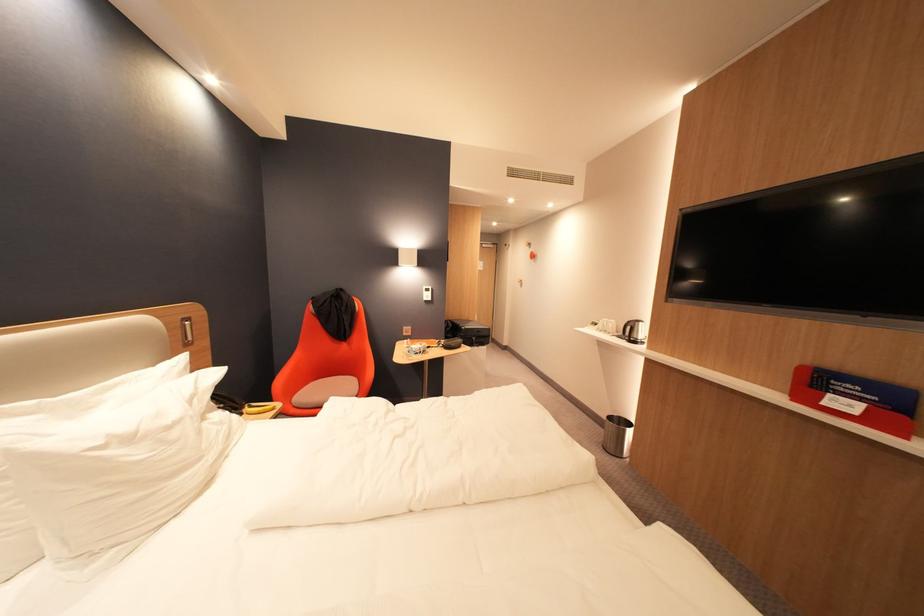
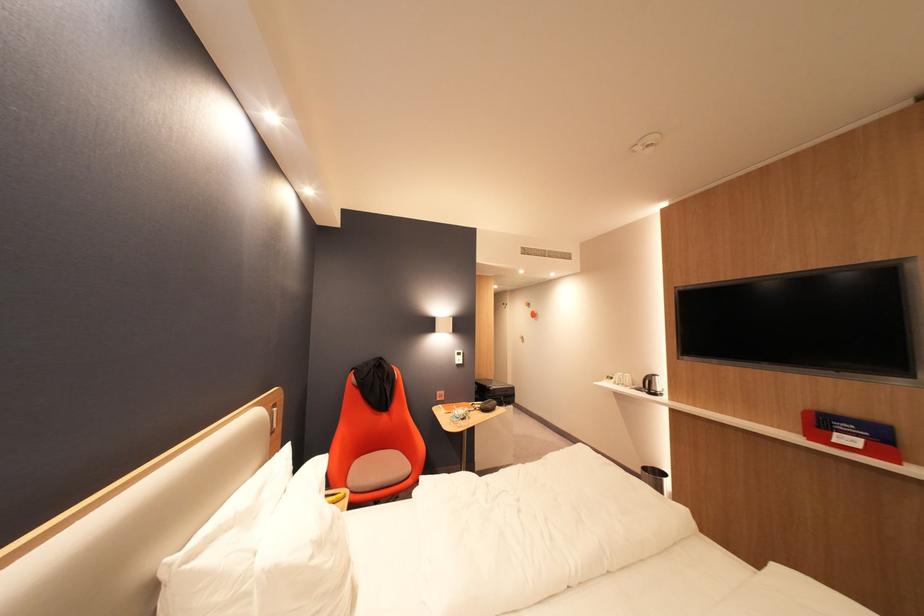
Locate, in the second image, the point that corresponds to point 641,341 in the first image.

(662, 392)